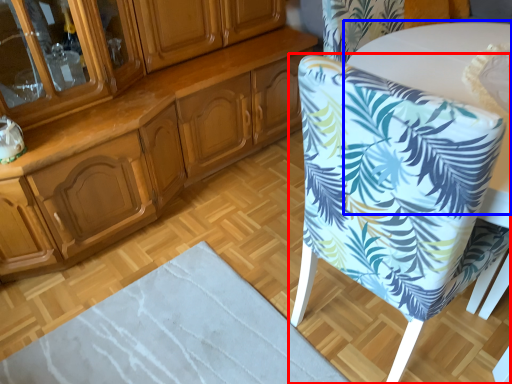
Question: Which point is further to the camera, chair (highlighted by a red box) or round table (highlighted by a blue box)?

Choices:
 (A) chair
 (B) round table

Answer: (B)